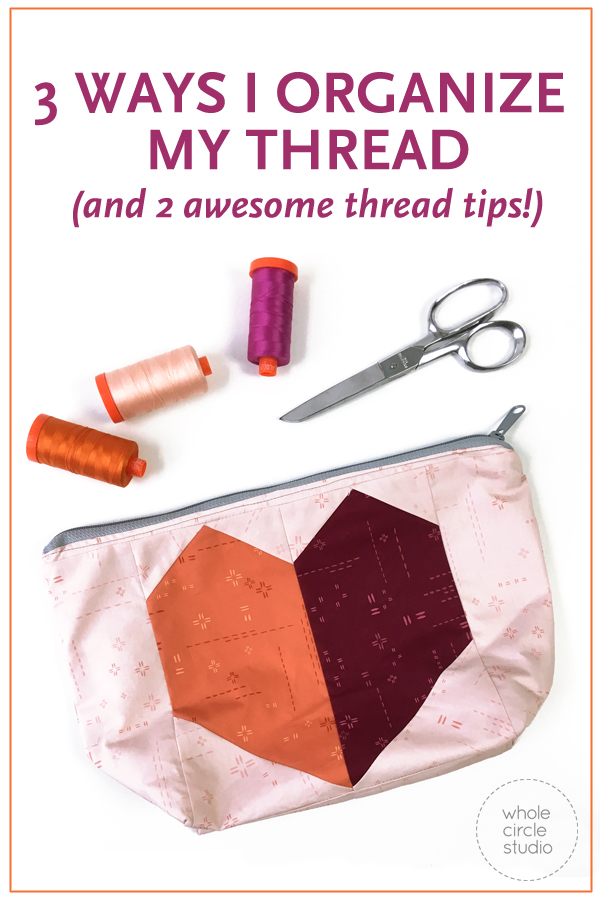
Find the location of a particular element. Image resolution: width=600 pixels, height=900 pixels. handle is located at coordinates (491, 297), (508, 328).